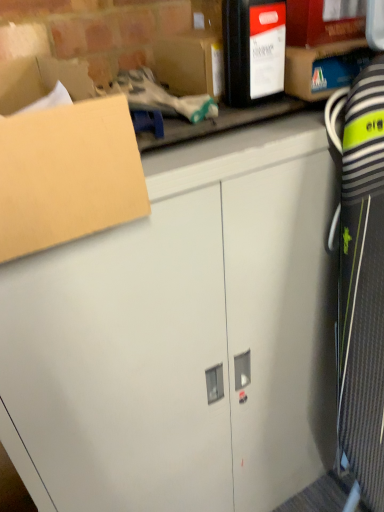
Question: Should I look upward or downward to see white matte cabinet at center?

Choices:
 (A) down
 (B) up

Answer: (A)

Question: Is brown cardboard box at upper left surrounding matte cardboard box at upper right, which is counted as the 1th storage box, starting from the right?

Choices:
 (A) yes
 (B) no

Answer: (B)

Question: Is brown cardboard box at upper left looking in the opposite direction of matte cardboard box at upper right, which is counted as the 1th storage box, starting from the right?

Choices:
 (A) yes
 (B) no

Answer: (B)

Question: From a real-world perspective, is brown cardboard box at upper left over matte cardboard box at upper right, the 2th storage box when ordered from left to right?

Choices:
 (A) no
 (B) yes

Answer: (A)

Question: Is brown cardboard box at upper left not within matte cardboard box at upper right, which is counted as the 1th storage box, starting from the right?

Choices:
 (A) no
 (B) yes

Answer: (B)

Question: Is brown cardboard box at upper left thinner than matte cardboard box at upper right, which is counted as the 1th storage box, starting from the right?

Choices:
 (A) no
 (B) yes

Answer: (A)

Question: Is brown cardboard box at upper left bigger than matte cardboard box at upper right, which is counted as the 1th storage box, starting from the right?

Choices:
 (A) no
 (B) yes

Answer: (B)

Question: Considering the relative sizes of matte cardboard box at upper right, the 2th storage box when ordered from left to right, and brown cardboard box at upper left in the image provided, is matte cardboard box at upper right, the 2th storage box when ordered from left to right, smaller than brown cardboard box at upper left?

Choices:
 (A) yes
 (B) no

Answer: (A)

Question: From a real-world perspective, is matte cardboard box at upper right, the 2th storage box when ordered from left to right, physically below brown cardboard box at upper left?

Choices:
 (A) no
 (B) yes

Answer: (A)

Question: Does matte cardboard box at upper right, which is counted as the 1th storage box, starting from the right, have a lesser width compared to brown cardboard box at upper left?

Choices:
 (A) yes
 (B) no

Answer: (A)

Question: Considering the relative sizes of matte cardboard box at upper right, the 2th storage box when ordered from left to right, and brown cardboard box at upper left in the image provided, is matte cardboard box at upper right, the 2th storage box when ordered from left to right, shorter than brown cardboard box at upper left?

Choices:
 (A) yes
 (B) no

Answer: (B)

Question: Is matte cardboard box at upper right, the 2th storage box when ordered from left to right, facing away from brown cardboard box at upper left?

Choices:
 (A) yes
 (B) no

Answer: (B)

Question: Does matte cardboard box at upper right, the 2th storage box when ordered from left to right, come behind brown cardboard box at upper left?

Choices:
 (A) yes
 (B) no

Answer: (A)

Question: Does matte black box at upper center, placed as the second storage box when sorted from right to left, have a lesser height compared to white matte cabinet at center?

Choices:
 (A) yes
 (B) no

Answer: (A)